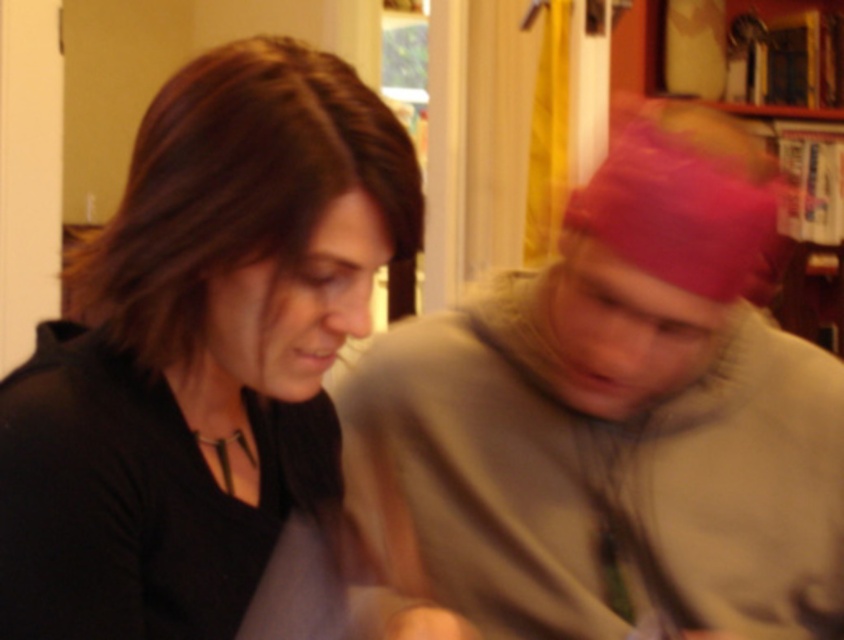
Question: Is black matte shirt at left wider than wooden bookshelf at upper right?

Choices:
 (A) no
 (B) yes

Answer: (A)

Question: Is black matte shirt at left thinner than wooden bookshelf at upper right?

Choices:
 (A) no
 (B) yes

Answer: (B)

Question: Which of the following is the closest to the observer?

Choices:
 (A) (208, 136)
 (B) (625, 48)
 (C) (694, 275)

Answer: (A)

Question: Among these points, which one is farthest from the camera?

Choices:
 (A) (152, 490)
 (B) (642, 58)
 (C) (823, 531)

Answer: (B)

Question: Which object appears closest to the camera in this image?

Choices:
 (A) black matte shirt at left
 (B) wooden bookshelf at upper right

Answer: (A)

Question: Is gray fleece sweater at center to the right of wooden bookshelf at upper right from the viewer's perspective?

Choices:
 (A) no
 (B) yes

Answer: (A)